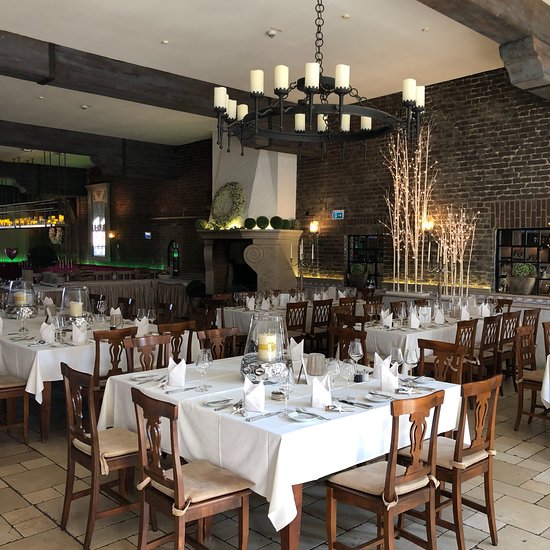
In order to click on tables in this screenshot , I will do `click(38, 355)`, `click(124, 283)`, `click(242, 316)`, `click(415, 337)`, `click(306, 444)`.